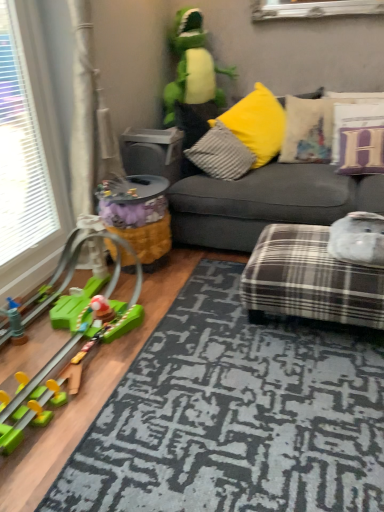
At what (x,y) coordinates should I click in order to perform the action: click on free space in front of yellow fabric toy at center, which is counted as the 2th toy, starting from the top. Please return your answer as a coordinate pair (x, y). Image resolution: width=384 pixels, height=512 pixels. Looking at the image, I should click on (133, 293).